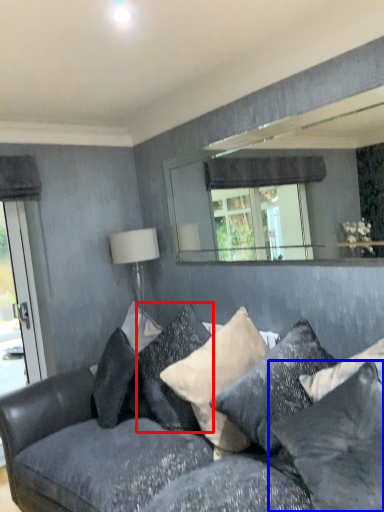
Question: Which object is closer to the camera taking this photo, pillow (highlighted by a red box) or pillow (highlighted by a blue box)?

Choices:
 (A) pillow
 (B) pillow

Answer: (B)